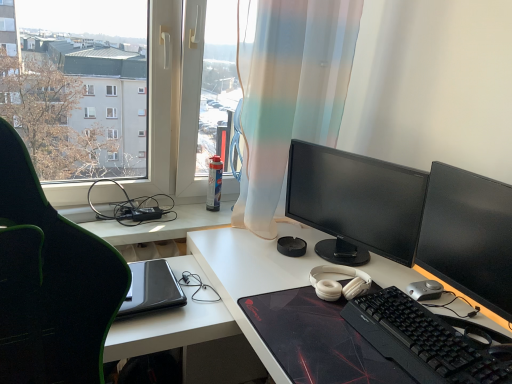
Question: Is the position of translucent fabric curtain at center more distant than that of silver metallic mouse at lower right?

Choices:
 (A) no
 (B) yes

Answer: (A)

Question: Can you confirm if translucent fabric curtain at center is smaller than silver metallic mouse at lower right?

Choices:
 (A) yes
 (B) no

Answer: (B)

Question: From a real-world perspective, is translucent fabric curtain at center beneath silver metallic mouse at lower right?

Choices:
 (A) no
 (B) yes

Answer: (A)

Question: Is translucent fabric curtain at center positioned far away from silver metallic mouse at lower right?

Choices:
 (A) yes
 (B) no

Answer: (B)

Question: From the image's perspective, is translucent fabric curtain at center located beneath silver metallic mouse at lower right?

Choices:
 (A) yes
 (B) no

Answer: (B)

Question: Considering the positions of silver metallic mouse at lower right and black matte desk at center in the image, is silver metallic mouse at lower right bigger or smaller than black matte desk at center?

Choices:
 (A) big
 (B) small

Answer: (B)

Question: Which is correct: silver metallic mouse at lower right is inside black matte desk at center, or outside of it?

Choices:
 (A) inside
 (B) outside

Answer: (B)

Question: Visually, is silver metallic mouse at lower right positioned to the left or to the right of black matte desk at center?

Choices:
 (A) left
 (B) right

Answer: (B)

Question: Is point (412, 288) closer or farther from the camera than point (382, 258)?

Choices:
 (A) farther
 (B) closer

Answer: (B)

Question: Visually, is black textured mousepad at center positioned to the left or to the right of black matte desk at center?

Choices:
 (A) left
 (B) right

Answer: (B)

Question: Is point click(x=374, y=374) closer or farther from the camera than point click(x=402, y=286)?

Choices:
 (A) farther
 (B) closer

Answer: (B)

Question: From their relative heights in the image, would you say black textured mousepad at center is taller or shorter than black matte desk at center?

Choices:
 (A) tall
 (B) short

Answer: (B)

Question: From the image's perspective, is black textured mousepad at center above or below black matte desk at center?

Choices:
 (A) above
 (B) below

Answer: (A)

Question: Is black matte desk at center in front of or behind matte black monitor at center, positioned as the 2th computer monitor in front-to-back order, in the image?

Choices:
 (A) behind
 (B) front

Answer: (B)

Question: Visually, is black matte desk at center positioned to the left or to the right of matte black monitor at center, the 1th computer monitor when ordered from back to front?

Choices:
 (A) right
 (B) left

Answer: (B)